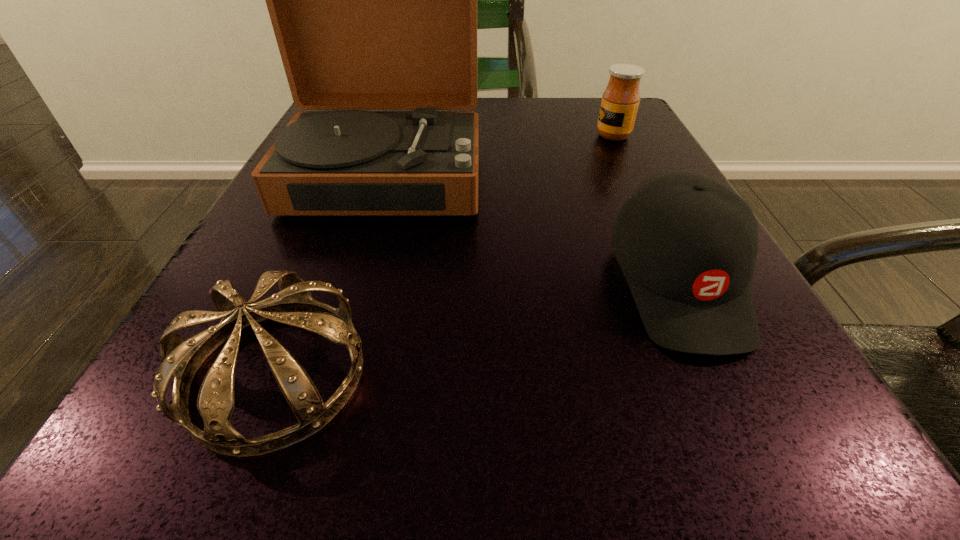
This screenshot has height=540, width=960. Identify the location of phonograph record. (373, 0).

The width and height of the screenshot is (960, 540). Identify the location of honey. coord(620,100).

At what (x,y) coordinates should I click in order to perform the action: click on tiara. Please return your answer as a coordinate pair (x, y). Looking at the image, I should click on (293, 305).

What are the coordinates of `baseball cap` in the screenshot? It's located at (687, 244).

Identify the location of blank area located on the face of the tallest object. (342, 320).

This screenshot has height=540, width=960. What are the coordinates of `vacant position located on the front-facing side of the honey` in the screenshot? It's located at (466, 136).

Where is `free space located on the front-facing side of the honey`? This screenshot has width=960, height=540. free space located on the front-facing side of the honey is located at coordinates (549, 136).

Locate an element on the screen. The width and height of the screenshot is (960, 540). vacant space located 0.100m on the front-facing side of the honey is located at coordinates (543, 136).

Find the location of a particular element. free space located 0.380m on the back of the tiara is located at coordinates (364, 154).

This screenshot has height=540, width=960. What are the coordinates of `vacant space located 0.070m with a logo on the front of the baseball cap` in the screenshot? It's located at (744, 424).